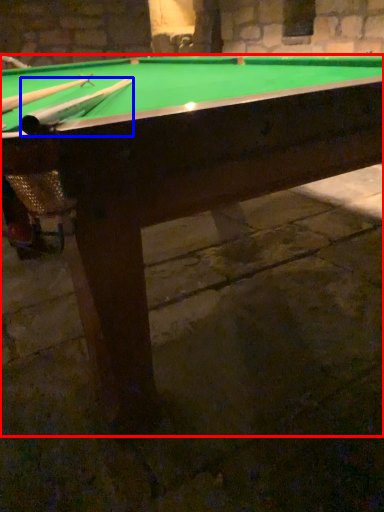
Question: Which point is closer to the camera, billiard table (highlighted by a red box) or cue (highlighted by a blue box)?

Choices:
 (A) billiard table
 (B) cue

Answer: (A)